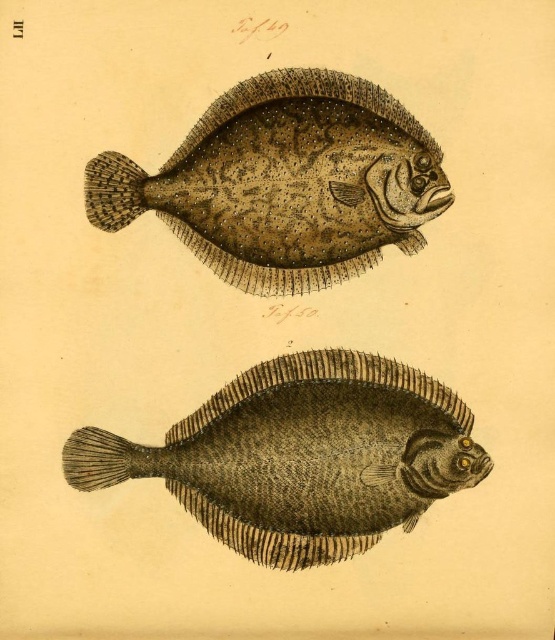
Measure the distance from brown textured fish at center to speckled textured fish at upper center.

10.19 inches

Between point (335, 401) and point (118, 156), which one is positioned behind?

The point (335, 401) is behind.

Measure the distance between point (458, 404) and camera.

Point (458, 404) and camera are 1.34 meters apart.

Find the location of a particular element. The width and height of the screenshot is (555, 640). brown textured fish at center is located at coordinates (302, 456).